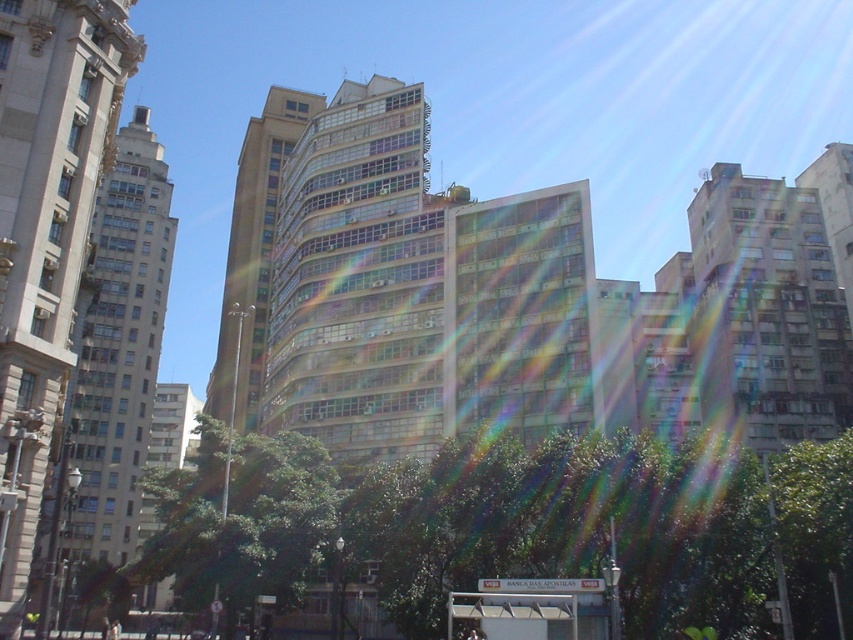
You are a pedestrian standing at the white plastic bus stop at lower center and want to see the smooth beige building at left. Can you see it clearly from your current position?

The white plastic bus stop at lower center is behind the smooth beige building at left, so the building is blocking your view. You cannot see the smooth beige building at left from your current position.

You are an architect evaluating the urban layout. Given the smooth beige building at left and the green leafy tree at center, which one has a narrower width from an observer standing in front of them?

The smooth beige building at left is thinner than the green leafy tree at center, so the smooth beige building at left has a narrower width.